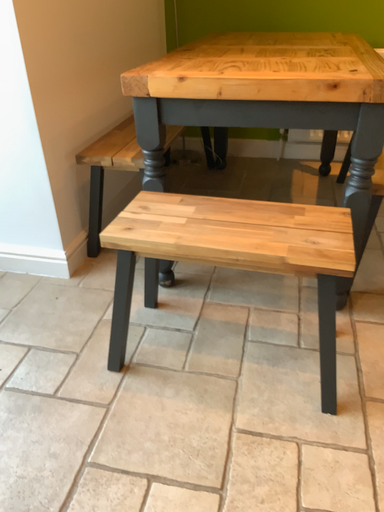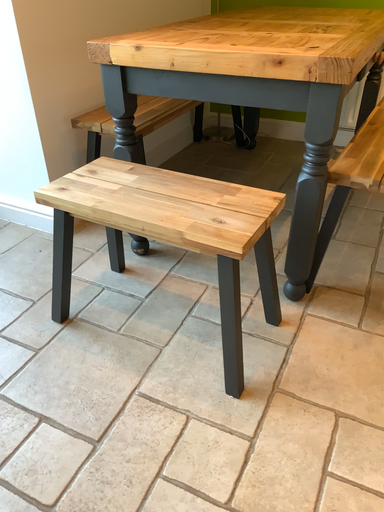
Question: Which way did the camera rotate in the video?

Choices:
 (A) rotated right
 (B) rotated left

Answer: (B)